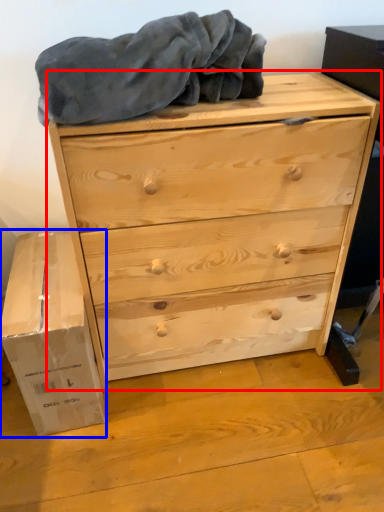
Question: Among these objects, which one is nearest to the camera, chest of drawers (highlighted by a red box) or cardboard box (highlighted by a blue box)?

Choices:
 (A) chest of drawers
 (B) cardboard box

Answer: (A)